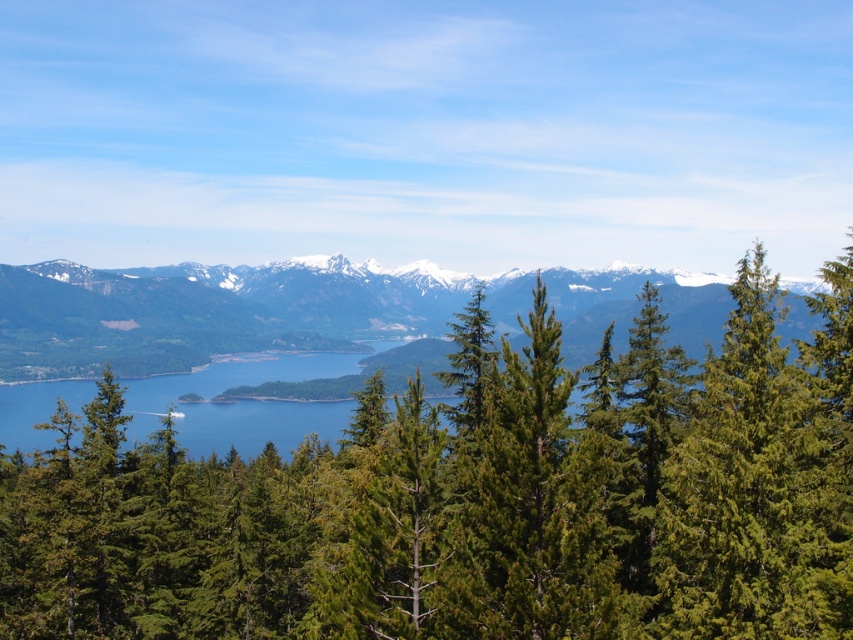
Question: Can you confirm if green needle-like trees at center is smaller than green coniferous trees at center?

Choices:
 (A) no
 (B) yes

Answer: (B)

Question: Observing the image, what is the correct spatial positioning of green needle-like trees at center in reference to green coniferous trees at center?

Choices:
 (A) right
 (B) left

Answer: (B)

Question: Where is green needle-like trees at center located in relation to green coniferous trees at center in the image?

Choices:
 (A) below
 (B) above

Answer: (A)

Question: Which point is farther from the camera taking this photo?

Choices:
 (A) (711, 609)
 (B) (32, 317)

Answer: (B)

Question: Among these objects, which one is nearest to the camera?

Choices:
 (A) green needle-like trees at center
 (B) green coniferous trees at center

Answer: (A)